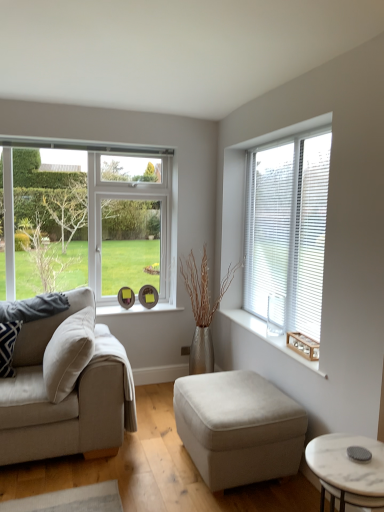
Question: From the image's perspective, is patterned fabric pillow at left positioned above or below clear glass window at left, marked as the second window in a right-to-left arrangement?

Choices:
 (A) below
 (B) above

Answer: (A)

Question: Considering the positions of patterned fabric pillow at left and clear glass window at left, which appears as the 1th window when viewed from the left, in the image, is patterned fabric pillow at left bigger or smaller than clear glass window at left, which appears as the 1th window when viewed from the left,?

Choices:
 (A) small
 (B) big

Answer: (A)

Question: Which object is positioned closest to the white marble coffee table at lower right?

Choices:
 (A) beige fabric couch at left
 (B) wooden window sill at right
 (C) patterned fabric pillow at left
 (D) beige fabric ottoman at center
 (E) clear glass window at left, which appears as the 1th window when viewed from the left

Answer: (D)

Question: Which of these objects is positioned farthest from the beige fabric ottoman at center?

Choices:
 (A) white blinds at upper right, which is the second window in left-to-right order
 (B) patterned fabric pillow at left
 (C) white marble coffee table at lower right
 (D) clear glass window at left, marked as the second window in a right-to-left arrangement
 (E) beige fabric couch at left

Answer: (D)